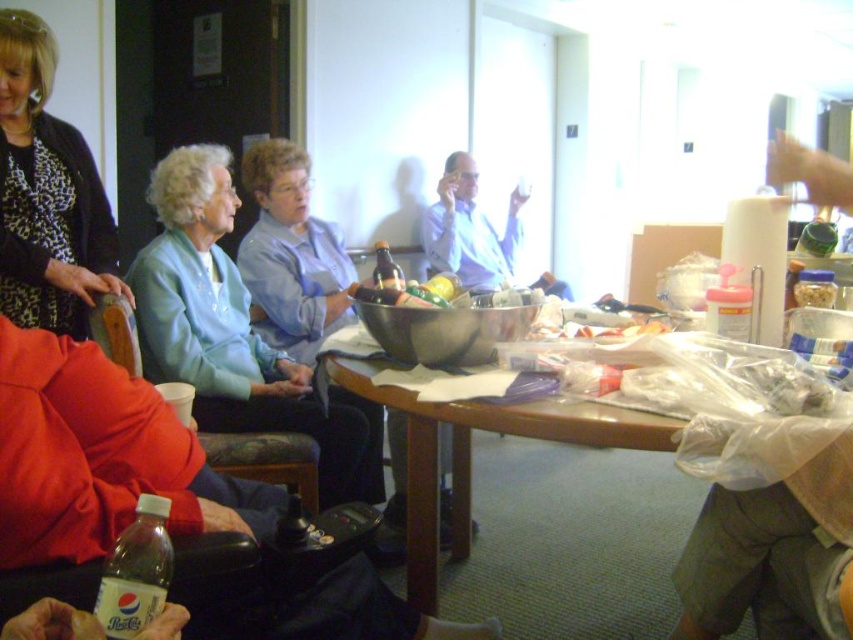
Question: Is the position of leopard print fabric at upper left more distant than that of brown glossy table at center?

Choices:
 (A) yes
 (B) no

Answer: (A)

Question: Which point appears closest to the camera in this image?

Choices:
 (A) (229, 390)
 (B) (10, 312)

Answer: (B)

Question: Which of the following is the farthest from the observer?

Choices:
 (A) (834, 593)
 (B) (461, 468)

Answer: (B)

Question: Is white paper towel at right bigger than brown glossy table at center?

Choices:
 (A) yes
 (B) no

Answer: (B)

Question: Which of the following is the closest to the observer?

Choices:
 (A) light blue fabric jacket at upper left
 (B) brown glossy table at center

Answer: (B)

Question: Does light blue fabric jacket at upper left appear on the right side of white paper towel at right?

Choices:
 (A) no
 (B) yes

Answer: (A)